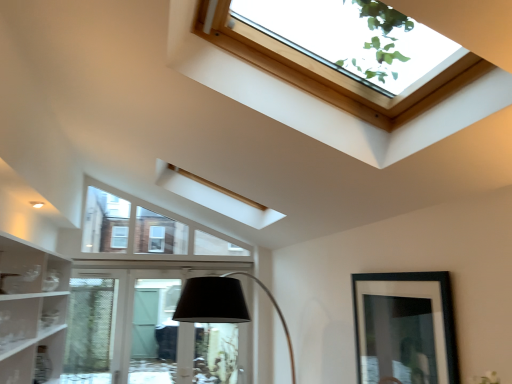
Question: From a real-world perspective, is black matte picture frame at lower right physically below wooden frame skylight at upper center?

Choices:
 (A) no
 (B) yes

Answer: (B)

Question: Does black matte picture frame at lower right have a lesser width compared to wooden frame skylight at upper center?

Choices:
 (A) yes
 (B) no

Answer: (A)

Question: Is black matte picture frame at lower right to the left of wooden frame skylight at upper center from the viewer's perspective?

Choices:
 (A) no
 (B) yes

Answer: (A)

Question: Would you say black matte picture frame at lower right is outside wooden frame skylight at upper center?

Choices:
 (A) no
 (B) yes

Answer: (B)

Question: Considering the relative sizes of black matte picture frame at lower right and wooden frame skylight at upper center in the image provided, is black matte picture frame at lower right wider than wooden frame skylight at upper center?

Choices:
 (A) no
 (B) yes

Answer: (A)

Question: From the image's perspective, relative to black matte picture frame at lower right, is wooden frame skylight at upper center above or below?

Choices:
 (A) below
 (B) above

Answer: (B)

Question: Looking at their shapes, would you say wooden frame skylight at upper center is wider or thinner than black matte picture frame at lower right?

Choices:
 (A) thin
 (B) wide

Answer: (B)

Question: From a real-world perspective, is wooden frame skylight at upper center positioned above or below black matte picture frame at lower right?

Choices:
 (A) above
 (B) below

Answer: (A)

Question: Which is correct: wooden frame skylight at upper center is inside black matte picture frame at lower right, or outside of it?

Choices:
 (A) outside
 (B) inside

Answer: (A)

Question: In terms of width, does clear glass door at lower center look wider or thinner when compared to black matte picture frame at lower right?

Choices:
 (A) wide
 (B) thin

Answer: (A)

Question: From the image's perspective, relative to black matte picture frame at lower right, is clear glass door at lower center above or below?

Choices:
 (A) above
 (B) below

Answer: (B)

Question: Relative to black matte picture frame at lower right, is clear glass door at lower center in front or behind?

Choices:
 (A) behind
 (B) front

Answer: (A)

Question: Is clear glass door at lower center situated inside black matte picture frame at lower right or outside?

Choices:
 (A) inside
 (B) outside

Answer: (B)

Question: Considering the positions of point (385, 321) and point (247, 49), is point (385, 321) closer or farther from the camera than point (247, 49)?

Choices:
 (A) closer
 (B) farther

Answer: (B)

Question: Looking at their shapes, would you say black matte picture frame at lower right is wider or thinner than wooden frame skylight at upper center?

Choices:
 (A) thin
 (B) wide

Answer: (A)